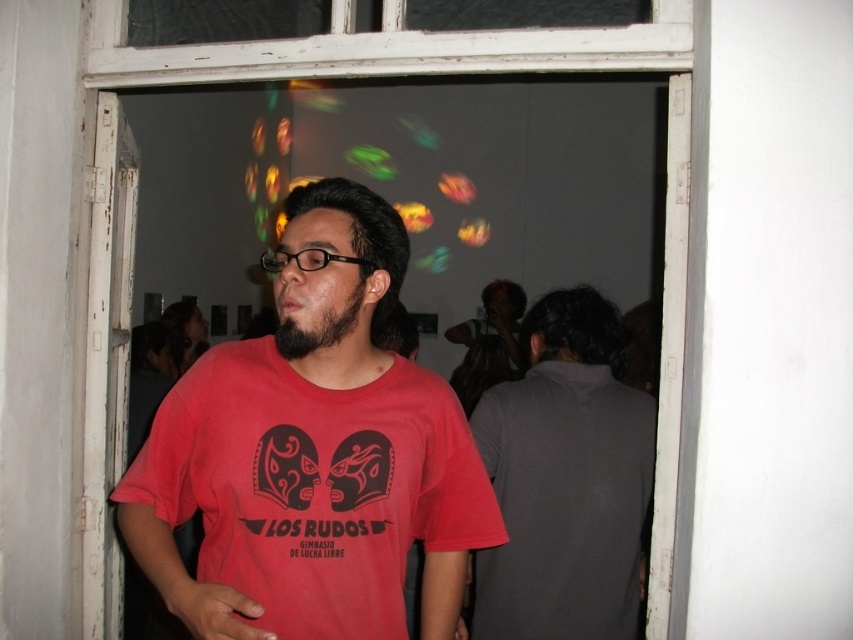
Question: Considering the real-world distances, which object is farthest from the transparent glass window at upper center?

Choices:
 (A) matte red t-shirt at center
 (B) dark gray shirt at right
 (C) black fuzzy beard at center

Answer: (C)

Question: Is matte red t-shirt at center behind dark gray shirt at right?

Choices:
 (A) no
 (B) yes

Answer: (A)

Question: Which object is the farthest from the dark gray shirt at right?

Choices:
 (A) transparent glass window at upper center
 (B) black fuzzy beard at center

Answer: (B)

Question: Does dark gray shirt at right appear over transparent glass window at upper center?

Choices:
 (A) no
 (B) yes

Answer: (A)

Question: Which point is farther from the camera taking this photo?

Choices:
 (A) (677, 216)
 (B) (289, 484)
 (C) (310, 332)
 (D) (534, 621)

Answer: (D)

Question: Is dark gray shirt at right wider than transparent glass window at upper center?

Choices:
 (A) no
 (B) yes

Answer: (A)